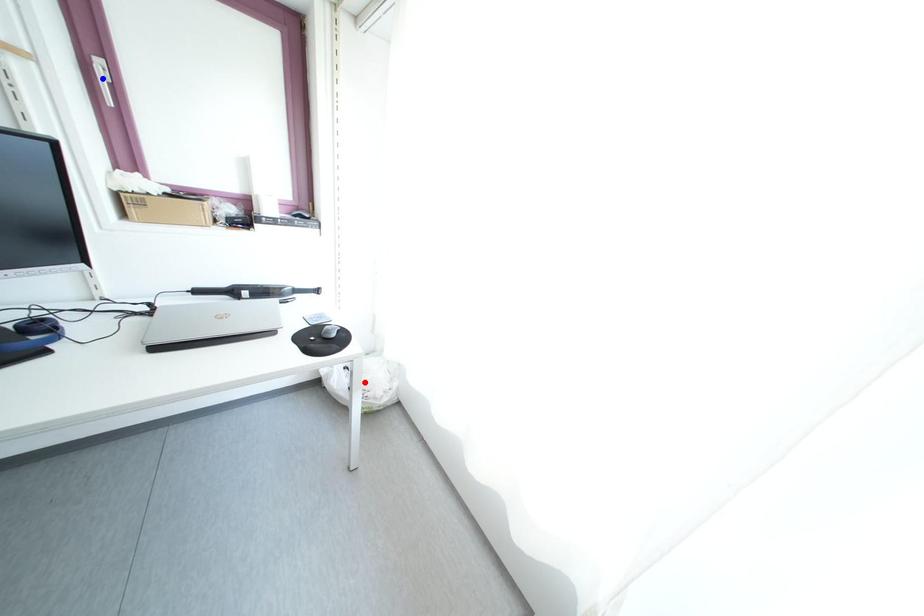
Question: In the image, two points are highlighted. Which point is nearer to the camera? Reply with the corresponding letter.

Choices:
 (A) blue point
 (B) red point

Answer: (A)